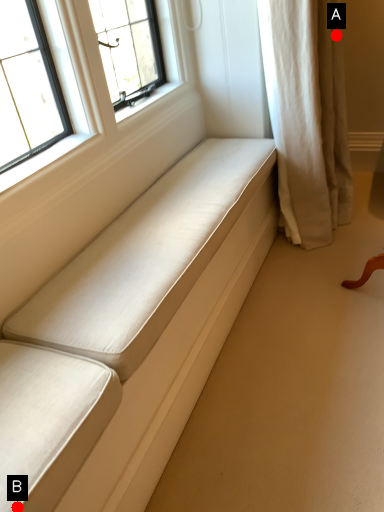
Question: Two points are circled on the image, labeled by A and B beside each circle. Among these points, which one is farthest from the camera?

Choices:
 (A) A is further
 (B) B is further

Answer: (A)